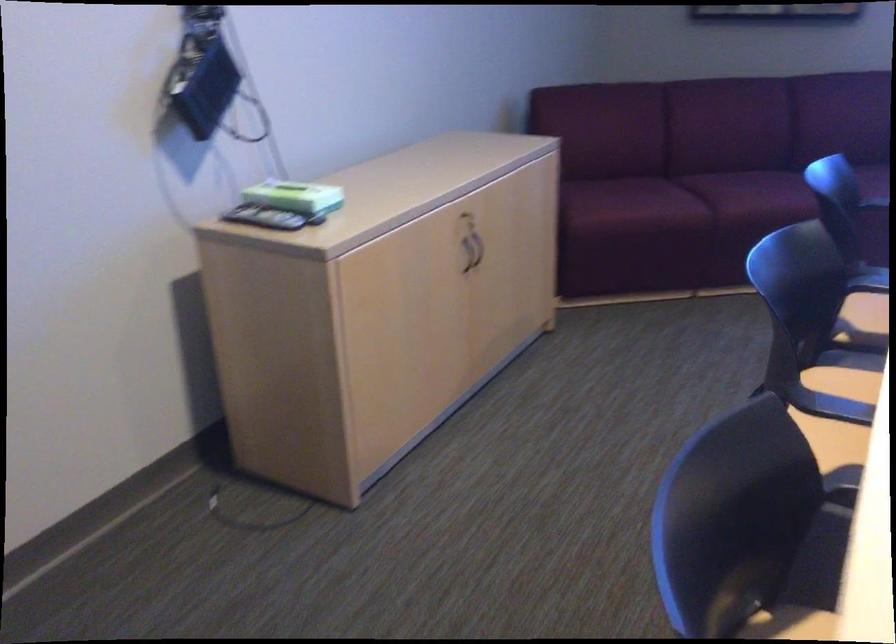
Identify the location of cabinet door handle. (464, 259).